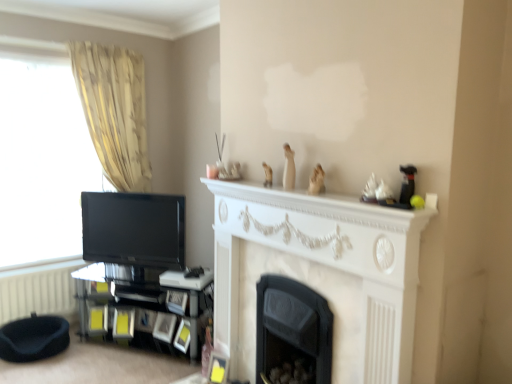
Question: Looking at their shapes, would you say black matte fireplace at center, which is the 2th fireplace from front to back, is wider or thinner than white textured radiator at lower left?

Choices:
 (A) wide
 (B) thin

Answer: (A)

Question: Considering the positions of black matte fireplace at center, placed as the 1th fireplace when sorted from back to front, and white textured radiator at lower left in the image, is black matte fireplace at center, placed as the 1th fireplace when sorted from back to front, bigger or smaller than white textured radiator at lower left?

Choices:
 (A) small
 (B) big

Answer: (B)

Question: Considering the real-world distances, which object is farthest from the black glossy tv at left?

Choices:
 (A) beige fabric curtain at left
 (B) white textured radiator at lower left
 (C) white marble fireplace at center
 (D) white marble fireplace at center, acting as the 2th fireplace starting from the back
 (E) black glass shelf at lower left

Answer: (D)

Question: Considering the real-world distances, which object is closest to the white marble fireplace at center?

Choices:
 (A) black glossy tv at left
 (B) white textured radiator at lower left
 (C) black glass shelf at lower left
 (D) black fabric footrest at lower left
 (E) white marble fireplace at center, acting as the 2th fireplace starting from the back

Answer: (E)